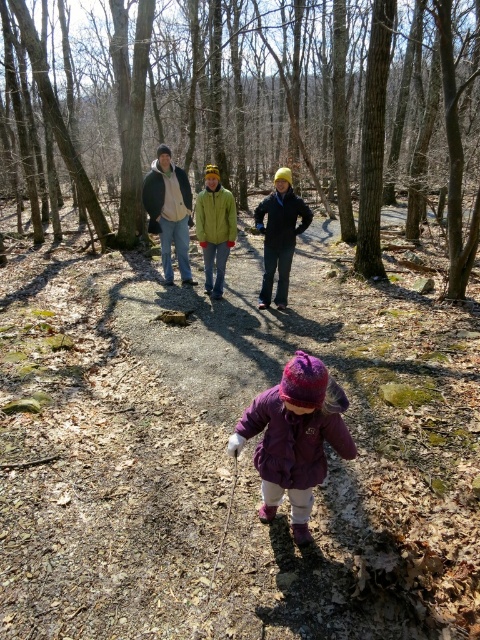
Question: Among these objects, which one is farthest from the camera?

Choices:
 (A) dark gray jacket at center
 (B) purple fleece jacket at center
 (C) smooth bark trees at upper center
 (D) matte yellow jacket at center

Answer: (A)

Question: Does smooth bark trees at upper center appear on the right side of matte yellow jacket at center?

Choices:
 (A) yes
 (B) no

Answer: (B)

Question: Which of the following is the farthest from the observer?

Choices:
 (A) matte yellow jacket at center
 (B) smooth bark trees at upper center

Answer: (A)

Question: Is smooth bark trees at upper center behind dark gray jacket at center?

Choices:
 (A) yes
 (B) no

Answer: (B)

Question: Estimate the real-world distances between objects in this image. Which object is closer to the matte yellow jacket at center?

Choices:
 (A) purple fleece jacket at center
 (B) dark gray jacket at center

Answer: (B)

Question: Does smooth bark trees at upper center appear on the left side of dark gray jacket at center?

Choices:
 (A) no
 (B) yes

Answer: (B)